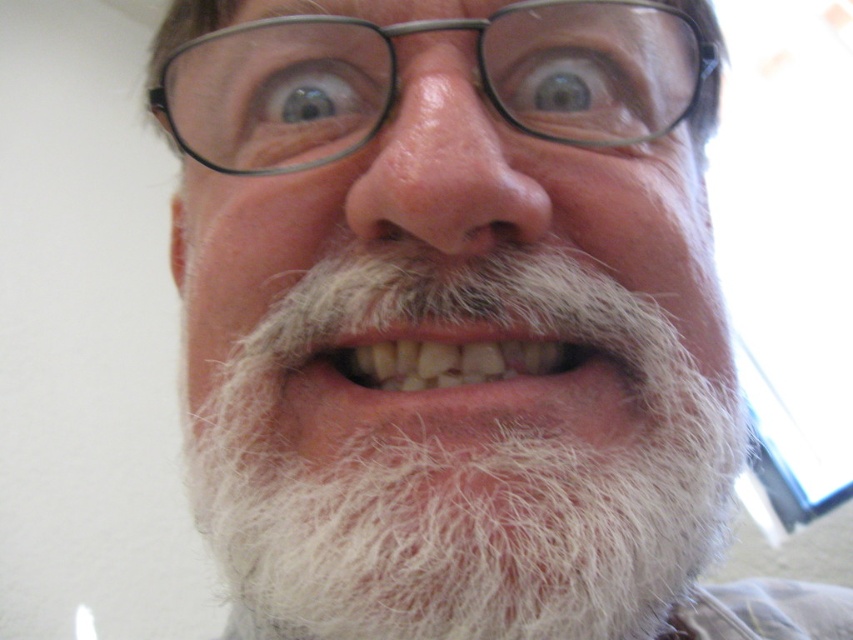
Who is more forward, (691, 474) or (646, 28)?

Point (691, 474)

Which is above, white fuzzy beard at center or black plastic glasses at upper center?

Positioned higher is black plastic glasses at upper center.

Between point (292, 541) and point (547, 51), which one is positioned behind?

Positioned behind is point (547, 51).

Locate an element on the screen. white fuzzy beard at center is located at coordinates (465, 464).

Consider the image. Can you confirm if white fuzzy beard at center is wider than natural white teeth at center?

Yes, white fuzzy beard at center is wider than natural white teeth at center.

Which of these two, white fuzzy beard at center or natural white teeth at center, stands shorter?

natural white teeth at center

Where is `white fuzzy beard at center`? white fuzzy beard at center is located at coordinates (465, 464).

How far apart are black plastic glasses at upper center and natural white teeth at center?

3.96 inches

Can you confirm if black plastic glasses at upper center is taller than natural white teeth at center?

Yes, black plastic glasses at upper center is taller than natural white teeth at center.

This screenshot has height=640, width=853. What are the coordinates of `black plastic glasses at upper center` in the screenshot? It's located at (396, 80).